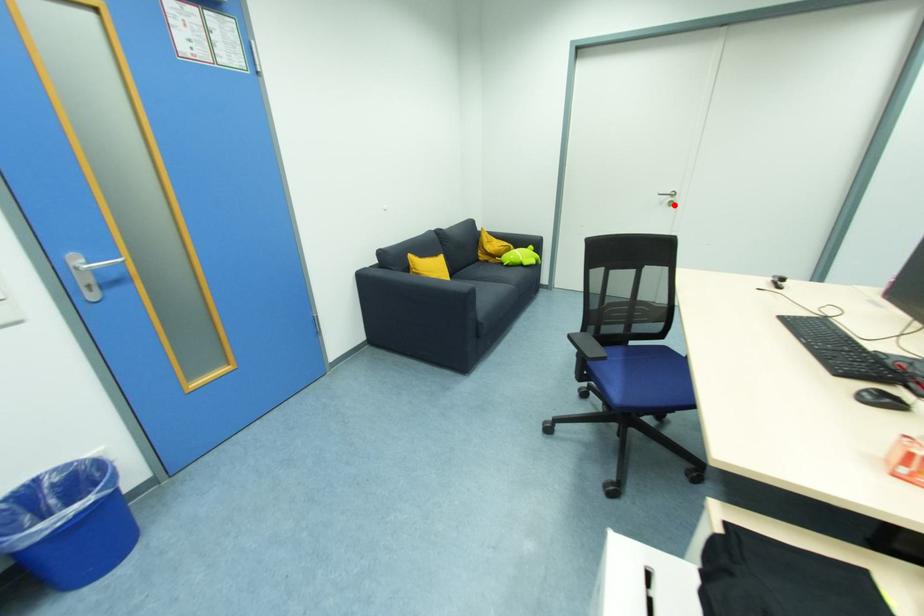
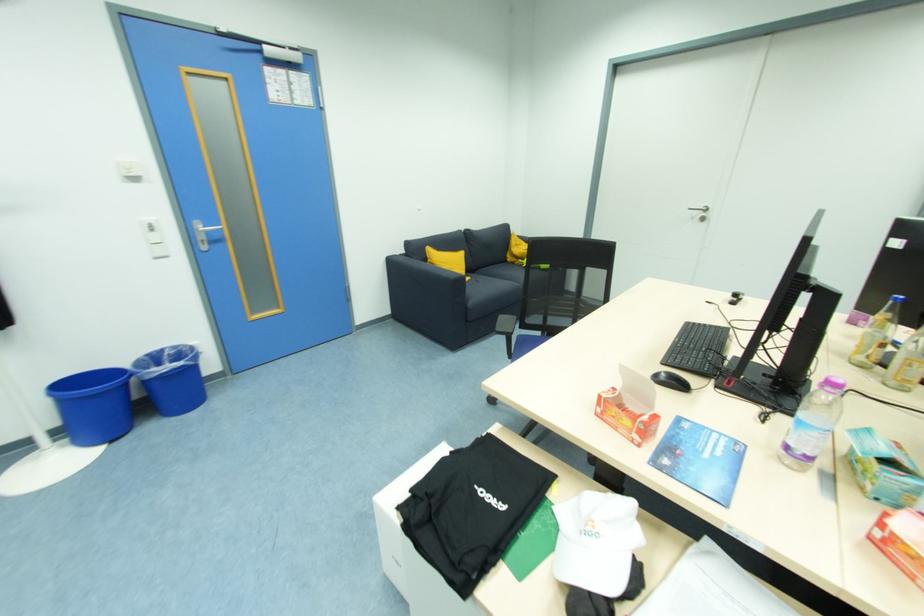
In the second image, find the point that corresponds to the highlighted location in the first image.

(706, 221)